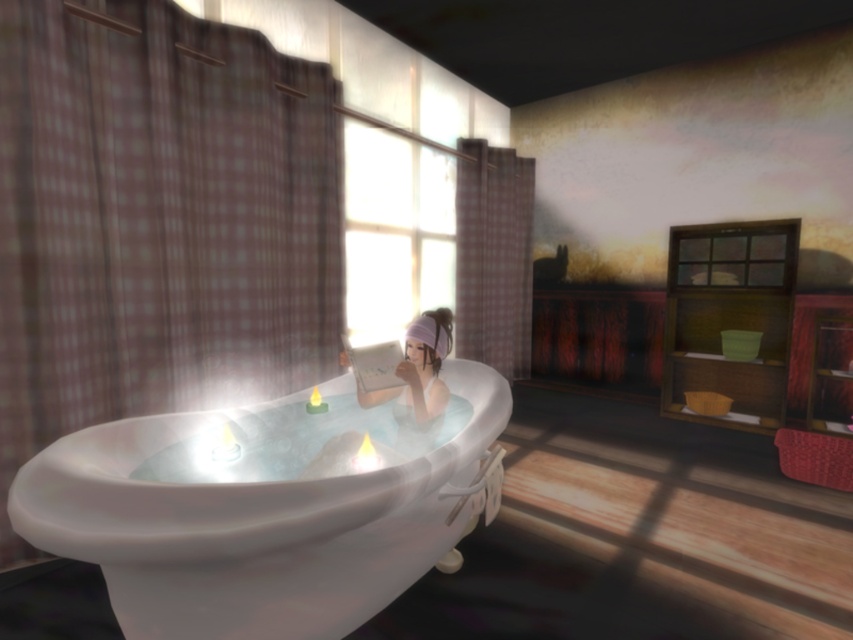
You are a designer planning to place a decorative vase between the white glossy bathtub at center and the white glossy hairband at center. The vase requires a minimum of 16 inches of space to be placed safely. Based on the scene, can the vase be placed between them?

The distance between the white glossy bathtub at center and the white glossy hairband at center is 15.13 inches, which is less than the required 16 inches for the vase. Therefore, the vase cannot be placed between them safely.

You are a delivery person holding a 1.2 meter long package. You need to place it on the floor near the white glossy bathtub at center without moving the bathtub. Is there enough space between you and the bathtub to do this?

The white glossy bathtub at center is 1.19 meters from camera. Since the package is 1.2 meters long, you would need at least 1.2 meters of space to place it. However, the distance available is only 1.19 meters, so there isn